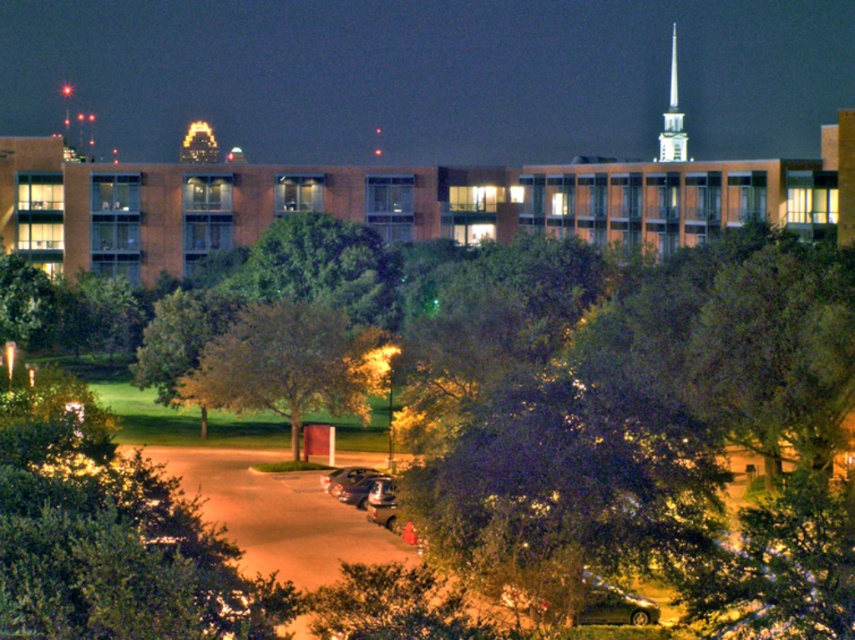
Between green leafy tree at center and silver metallic spire at upper right, which one is positioned lower?

green leafy tree at center is below.

Can you confirm if green leafy tree at center is taller than silver metallic spire at upper right?

Incorrect, green leafy tree at center's height is not larger of silver metallic spire at upper right's.

What do you see at coordinates (289, 364) in the screenshot?
I see `green leafy tree at center` at bounding box center [289, 364].

You are a GUI agent. You are given a task and a screenshot of the screen. Output one action in this format:
    pyautogui.click(x=<x>, y=<y>)
    Task: Click on the green leafy tree at center
    The width and height of the screenshot is (855, 640).
    Given the screenshot: What is the action you would take?
    pyautogui.click(x=289, y=364)